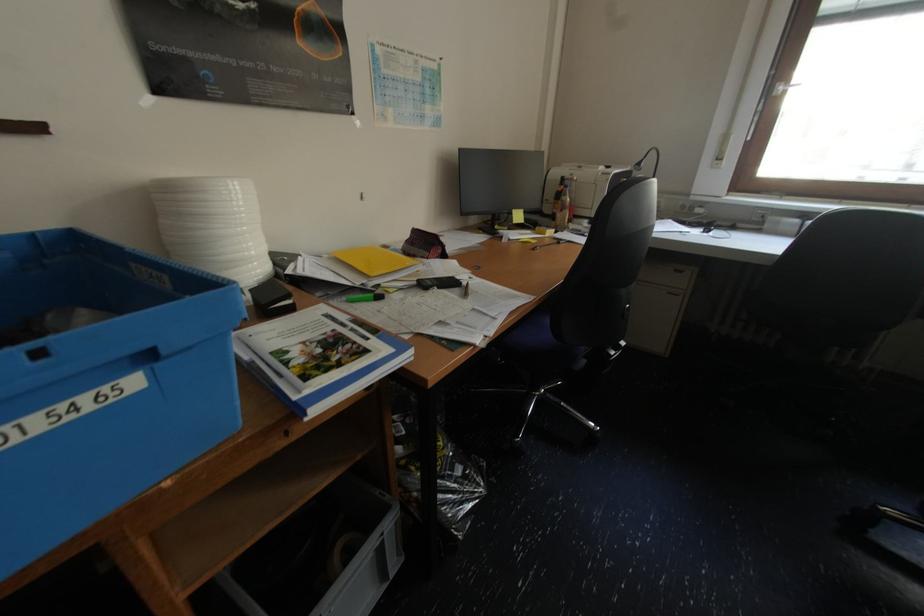
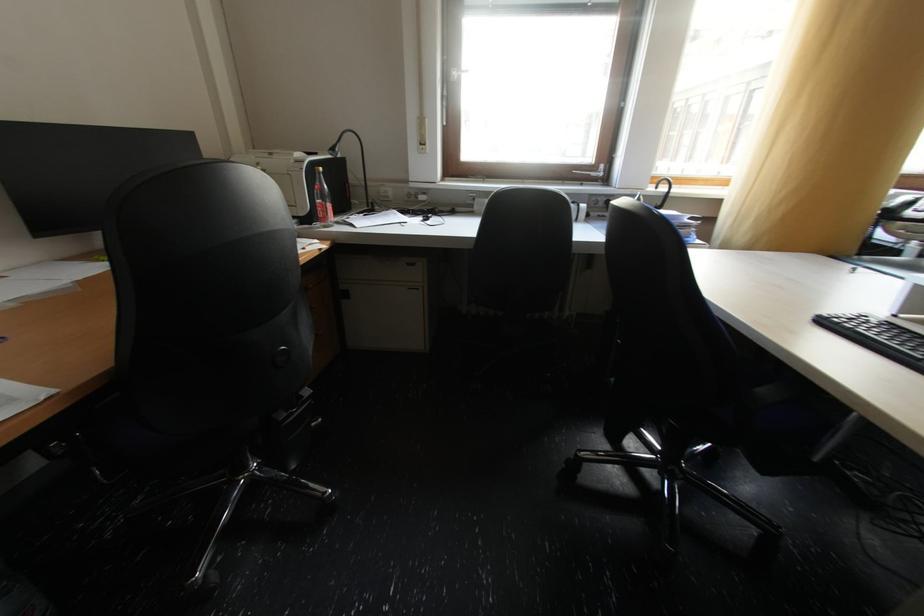
Question: The images are taken continuously from a first-person perspective. In which direction is your viewpoint rotating?

Choices:
 (A) Left
 (B) Right
 (C) Up
 (D) Down

Answer: (B)